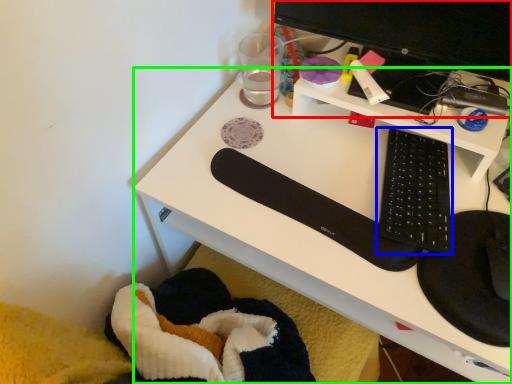
Question: Estimate the real-world distances between objects in this image. Which object is closer to desktop computer (highlighted by a red box), computer keyboard (highlighted by a blue box) or desk (highlighted by a green box)?

Choices:
 (A) computer keyboard
 (B) desk

Answer: (A)